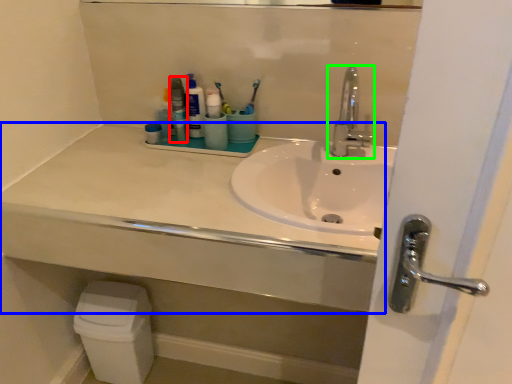
Question: Which object is positioned closest to mouthwash (highlighted by a red box)? Select from counter top (highlighted by a blue box) and tap (highlighted by a green box).

Choices:
 (A) counter top
 (B) tap

Answer: (A)